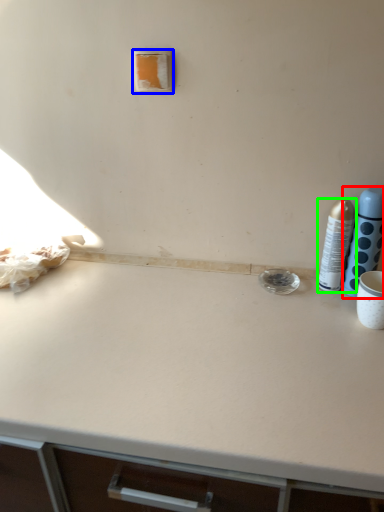
Question: Considering the real-world distances, which object is farthest from bottle (highlighted by a red box)? light switch (highlighted by a blue box) or bottle (highlighted by a green box)?

Choices:
 (A) light switch
 (B) bottle

Answer: (A)